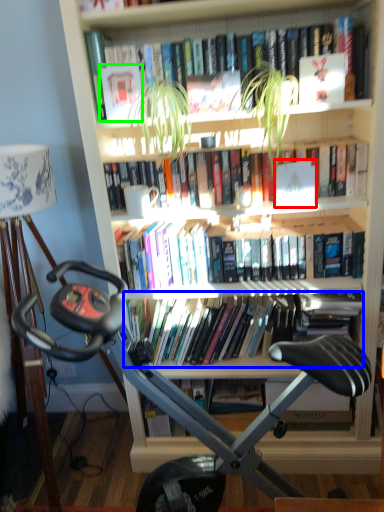
Question: Estimate the real-world distances between objects in this image. Which object is closer to paperback book (highlighted by a red box), book (highlighted by a blue box) or paperback book (highlighted by a green box)?

Choices:
 (A) book
 (B) paperback book

Answer: (A)